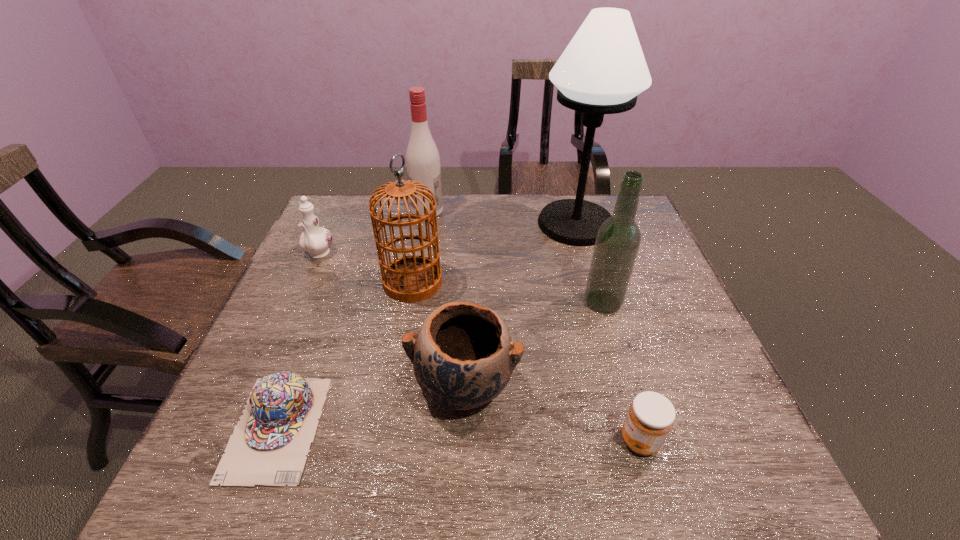
At what (x,y) coordinates should I click in order to perform the action: click on table lamp. Please return your answer as a coordinate pair (x, y). This screenshot has height=540, width=960. Looking at the image, I should click on [x=602, y=70].

Where is `alcohol`? This screenshot has height=540, width=960. alcohol is located at coordinates (422, 156).

Where is `birdcage`? birdcage is located at coordinates (413, 278).

Identify the location of liquor. (618, 239).

You are a GUI agent. You are given a task and a screenshot of the screen. Output one action in this format:
    pyautogui.click(x=<x>, y=<y>)
    Task: Click on the chinaware
    The image size is (960, 540).
    Given the screenshot: What is the action you would take?
    pyautogui.click(x=315, y=240)

In order to click on pottery in this screenshot , I will do `click(463, 357)`.

The height and width of the screenshot is (540, 960). Identify the location of jam. (650, 418).

This screenshot has width=960, height=540. Identify the location of the shortest object. (268, 447).

Where is `vacant space located 0.260m on the left of the tallest object`? This screenshot has height=540, width=960. vacant space located 0.260m on the left of the tallest object is located at coordinates (453, 224).

The height and width of the screenshot is (540, 960). I want to click on vacant region located 0.370m on the label of the alcohol, so click(556, 211).